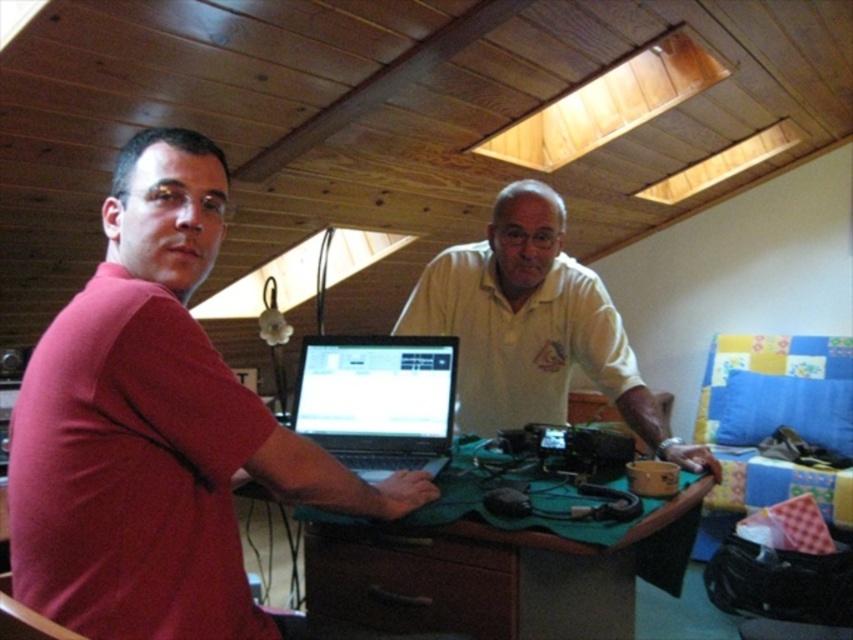
You are organizing the desk and need to place a small item between the green felt at center and the matte black laptop at center. Based on their positions, which object should the item be closer to?

The item should be placed closer to the matte black laptop at center because the green felt at center is located to the right of the matte black laptop at center.

In the scene shown: You are organizing a small event and need to place a decorative item on the desk. The matte red shirt at center and the green felt at center are both on the desk. Which object would you choose if you want to place a larger decorative item next to it?

The green felt at center is larger than the matte red shirt at center, so placing a larger decorative item next to it would be more appropriate.

You are organizing a photoshoot in the loft and need to place a small prop between the matte red shirt at center and the green felt at center. Based on their positions, which object should the prop be closer to?

The prop should be placed closer to the green felt at center because the matte red shirt at center is positioned on the left side of the green felt at center, meaning the green felt is to the right of the red shirt.